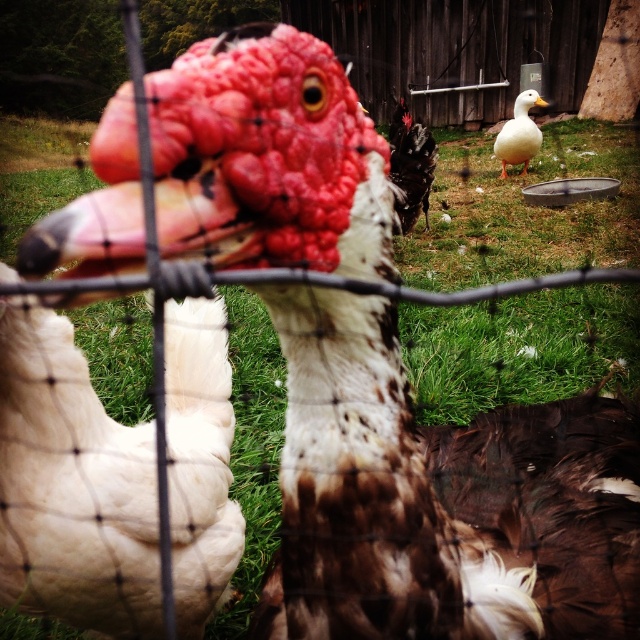
Question: Can you confirm if white fluffy chicken at left is positioned below white matte duck at upper right?

Choices:
 (A) yes
 (B) no

Answer: (A)

Question: Is white fluffy chicken at left below white matte duck at upper right?

Choices:
 (A) no
 (B) yes

Answer: (B)

Question: Which of the following is the farthest from the observer?

Choices:
 (A) (72, 413)
 (B) (524, 115)

Answer: (B)

Question: Which of the following is the closest to the observer?

Choices:
 (A) (54, 582)
 (B) (506, 138)

Answer: (A)

Question: Does white fluffy chicken at left have a greater width compared to white matte duck at upper right?

Choices:
 (A) no
 (B) yes

Answer: (A)